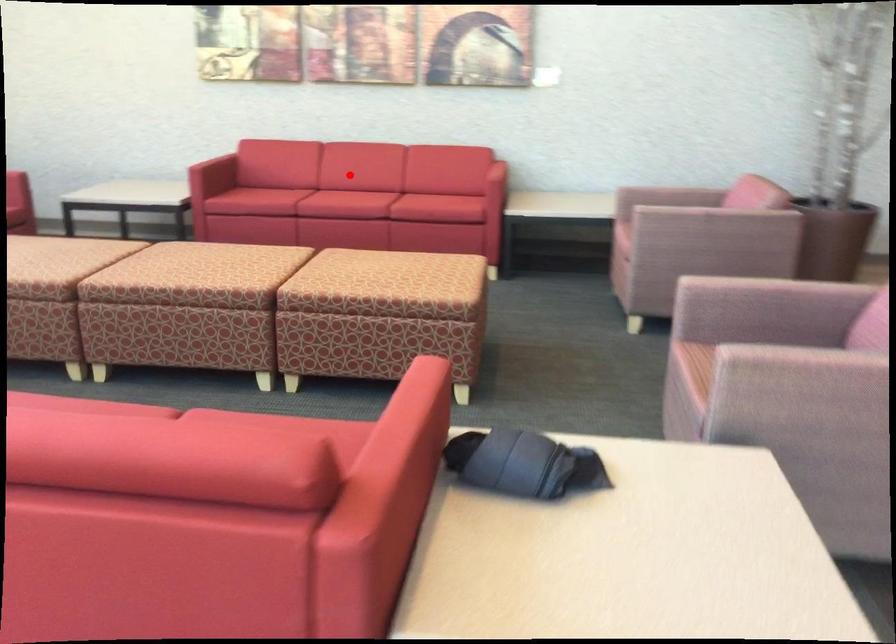
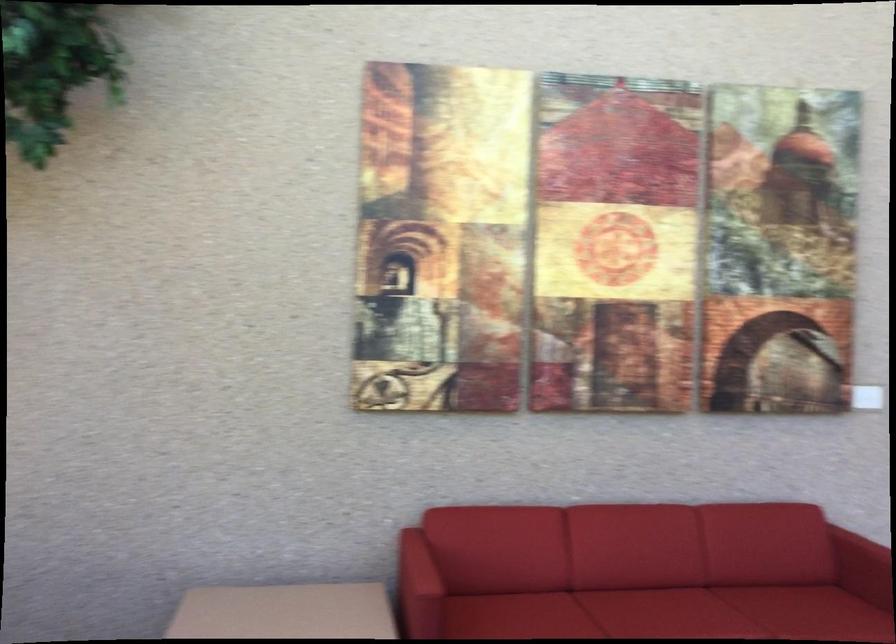
Locate, in the second image, the point that corresponds to the highlighted location in the first image.

(659, 607)